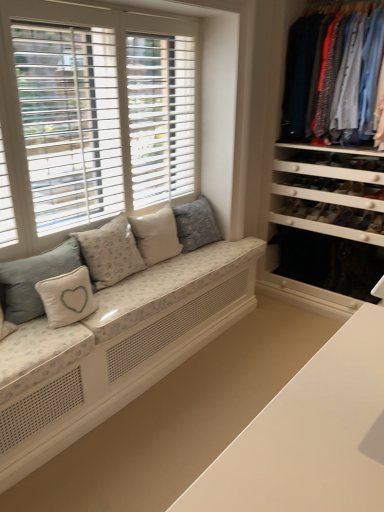
Question: Considering the relative sizes of light blue cotton shirts at right and light beige fabric pillow at center, which ranks as the second pillow in right-to-left order, in the image provided, is light blue cotton shirts at right bigger than light beige fabric pillow at center, which ranks as the second pillow in right-to-left order,?

Choices:
 (A) no
 (B) yes

Answer: (B)

Question: From the image's perspective, is light blue cotton shirts at right located beneath light beige fabric pillow at center, which ranks as the second pillow in right-to-left order?

Choices:
 (A) no
 (B) yes

Answer: (A)

Question: Is the depth of light blue cotton shirts at right greater than that of light beige fabric pillow at center, which ranks as the second pillow in right-to-left order?

Choices:
 (A) yes
 (B) no

Answer: (B)

Question: Could you tell me if light blue cotton shirts at right is facing light beige fabric pillow at center, which ranks as the second pillow in right-to-left order?

Choices:
 (A) no
 (B) yes

Answer: (A)

Question: From a real-world perspective, is light blue cotton shirts at right located higher than light beige fabric pillow at center, marked as the fourth pillow in a left-to-right arrangement?

Choices:
 (A) yes
 (B) no

Answer: (A)

Question: Relative to floral fabric cushion at center, which appears as the 5th pillow when viewed from the left, is white fabric pillow with heart design at left, placed as the 2th pillow when sorted from left to right, in front or behind?

Choices:
 (A) front
 (B) behind

Answer: (A)

Question: In terms of size, does white fabric pillow with heart design at left, placed as the 2th pillow when sorted from left to right, appear bigger or smaller than floral fabric cushion at center, acting as the first pillow starting from the right?

Choices:
 (A) big
 (B) small

Answer: (B)

Question: Visually, is white fabric pillow with heart design at left, the 4th pillow from the right, positioned to the left or to the right of floral fabric cushion at center, which appears as the 5th pillow when viewed from the left?

Choices:
 (A) right
 (B) left

Answer: (B)

Question: From their relative heights in the image, would you say white fabric pillow with heart design at left, the 4th pillow from the right, is taller or shorter than floral fabric cushion at center, which appears as the 5th pillow when viewed from the left?

Choices:
 (A) tall
 (B) short

Answer: (B)

Question: Is floral fabric cushion at center, which appears as the 5th pillow when viewed from the left, situated inside light beige fabric couch at lower left or outside?

Choices:
 (A) outside
 (B) inside

Answer: (A)

Question: In terms of size, does floral fabric cushion at center, which appears as the 5th pillow when viewed from the left, appear bigger or smaller than light beige fabric couch at lower left?

Choices:
 (A) big
 (B) small

Answer: (B)

Question: In terms of height, does floral fabric cushion at center, acting as the first pillow starting from the right, look taller or shorter compared to light beige fabric couch at lower left?

Choices:
 (A) short
 (B) tall

Answer: (B)

Question: Considering the positions of point tap(218, 236) and point tap(157, 339), is point tap(218, 236) closer or farther from the camera than point tap(157, 339)?

Choices:
 (A) closer
 (B) farther

Answer: (B)

Question: From a real-world perspective, relative to light blue cotton shirts at right, is white wood window at left vertically above or below?

Choices:
 (A) below
 (B) above

Answer: (A)

Question: Is point (180, 199) positioned closer to the camera than point (301, 92)?

Choices:
 (A) farther
 (B) closer

Answer: (A)